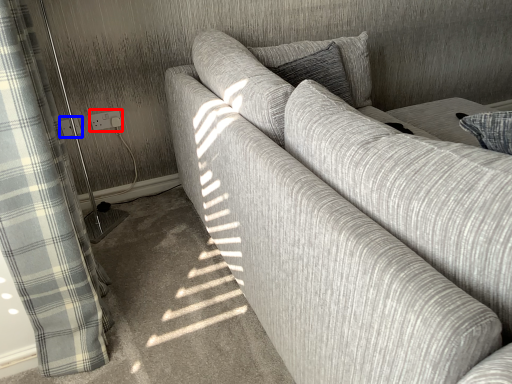
Question: Which object is further to the camera taking this photo, electric outlet (highlighted by a red box) or electric outlet (highlighted by a blue box)?

Choices:
 (A) electric outlet
 (B) electric outlet

Answer: (A)